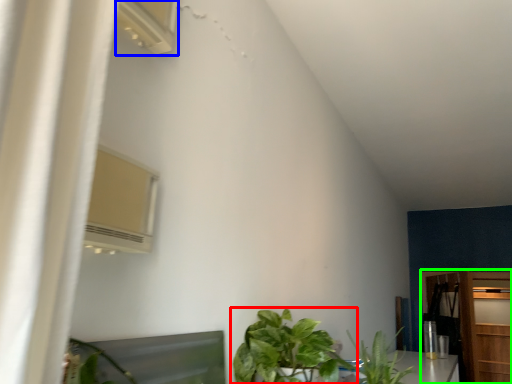
Question: Estimate the real-world distances between objects in this image. Which object is farther from houseplant (highlighted by a red box), air conditioner (highlighted by a blue box) or dresser (highlighted by a green box)?

Choices:
 (A) air conditioner
 (B) dresser

Answer: (B)